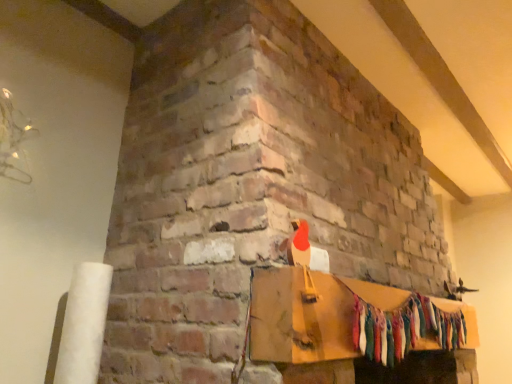
In order to face wooden mantel at upper center, should I rotate leftwards or rightwards?

To align with it, rotate right about 19.210°.

Measure the distance between point (x=325, y=360) and camera.

Point (x=325, y=360) is 3.65 feet from camera.

At what (x,y) coordinates should I click in order to perform the action: click on wooden mantel at upper center. Please return your answer as a coordinate pair (x, y). The height and width of the screenshot is (384, 512). Looking at the image, I should click on (343, 317).

This screenshot has height=384, width=512. What do you see at coordinates (343, 317) in the screenshot?
I see `wooden mantel at upper center` at bounding box center [343, 317].

This screenshot has width=512, height=384. What are the coordinates of `multicolored fabric garland at center` in the screenshot? It's located at (404, 329).

What do you see at coordinates (404, 329) in the screenshot? This screenshot has width=512, height=384. I see `multicolored fabric garland at center` at bounding box center [404, 329].

Locate an element on the screen. wooden mantel at upper center is located at coordinates (343, 317).

Can you confirm if multicolored fabric garland at center is positioned to the right of wooden mantel at upper center?

Yes, multicolored fabric garland at center is to the right of wooden mantel at upper center.

Is the position of multicolored fabric garland at center less distant than that of wooden mantel at upper center?

No.

Is point (438, 308) closer or farther from the camera than point (282, 345)?

Point (438, 308) is farther from the camera than point (282, 345).

From the image's perspective, which is above, multicolored fabric garland at center or wooden mantel at upper center?

From the image's view, wooden mantel at upper center is above.

From a real-world perspective, is multicolored fabric garland at center on wooden mantel at upper center?

No, from a real-world perspective, multicolored fabric garland at center is not above wooden mantel at upper center.

Between multicolored fabric garland at center and wooden mantel at upper center, which one has smaller width?

With smaller width is multicolored fabric garland at center.

Who is taller, multicolored fabric garland at center or wooden mantel at upper center?

multicolored fabric garland at center.

Considering the relative sizes of multicolored fabric garland at center and wooden mantel at upper center in the image provided, is multicolored fabric garland at center smaller than wooden mantel at upper center?

Yes.

Is multicolored fabric garland at center inside or outside of wooden mantel at upper center?

multicolored fabric garland at center fits inside wooden mantel at upper center.

Is multicolored fabric garland at center in contact with wooden mantel at upper center?

Indeed, multicolored fabric garland at center and wooden mantel at upper center are beside each other and touching.

Is multicolored fabric garland at center facing away from wooden mantel at upper center?

Yes, wooden mantel at upper center is at the back of multicolored fabric garland at center.

Based on the photo, what's the angular difference between multicolored fabric garland at center and wooden mantel at upper center's facing directions?

multicolored fabric garland at center and wooden mantel at upper center are facing 0.164 degrees away from each other.

This screenshot has width=512, height=384. Find the location of `clothing that appears on the right of wooden mantel at upper center`. clothing that appears on the right of wooden mantel at upper center is located at coordinates (404, 329).

Based on the photo, considering the positions of objects wooden mantel at upper center and multicolored fabric garland at center in the image provided, who is more to the left, wooden mantel at upper center or multicolored fabric garland at center?

wooden mantel at upper center.

Considering the relative positions of wooden mantel at upper center and multicolored fabric garland at center in the image provided, is wooden mantel at upper center in front of multicolored fabric garland at center?

Yes, wooden mantel at upper center is closer to the camera.

Which is behind, point (391, 298) or point (368, 322)?

The point (391, 298) is more distant.

From the image's perspective, which is below, wooden mantel at upper center or multicolored fabric garland at center?

multicolored fabric garland at center, from the image's perspective.

From a real-world perspective, does wooden mantel at upper center sit lower than multicolored fabric garland at center?

Incorrect, from a real-world perspective, wooden mantel at upper center is higher than multicolored fabric garland at center.

Looking at their sizes, would you say wooden mantel at upper center is wider or thinner than multicolored fabric garland at center?

wooden mantel at upper center is wider than multicolored fabric garland at center.

Is wooden mantel at upper center shorter than multicolored fabric garland at center?

Correct, wooden mantel at upper center is not as tall as multicolored fabric garland at center.

Considering the sizes of objects wooden mantel at upper center and multicolored fabric garland at center in the image provided, who is bigger, wooden mantel at upper center or multicolored fabric garland at center?

wooden mantel at upper center.

Does wooden mantel at upper center contain multicolored fabric garland at center?

Definitely not — multicolored fabric garland at center is not inside wooden mantel at upper center.

Does wooden mantel at upper center touch multicolored fabric garland at center?

Yes, wooden mantel at upper center is next to multicolored fabric garland at center.

Could you tell me if wooden mantel at upper center is facing multicolored fabric garland at center?

Yes, wooden mantel at upper center is facing multicolored fabric garland at center.

How much distance is there between wooden mantel at upper center and multicolored fabric garland at center?

They are 2.04 inches apart.

I want to click on furniture that appears in front of the multicolored fabric garland at center, so click(343, 317).

Where is `furniture above the multicolored fabric garland at center (from a real-world perspective)`? Image resolution: width=512 pixels, height=384 pixels. furniture above the multicolored fabric garland at center (from a real-world perspective) is located at coordinates (343, 317).

Where is `clothing on the right of wooden mantel at upper center`? The height and width of the screenshot is (384, 512). clothing on the right of wooden mantel at upper center is located at coordinates (404, 329).